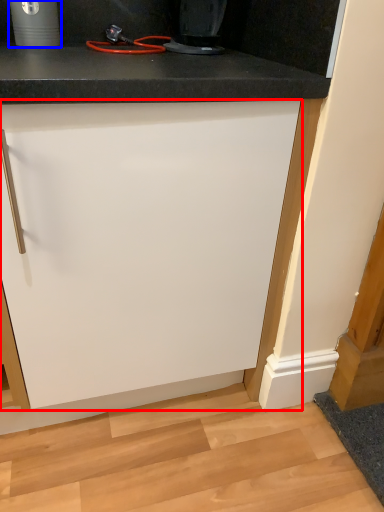
Question: Which object appears farthest to the camera in this image, cabinetry (highlighted by a red box) or appliance (highlighted by a blue box)?

Choices:
 (A) cabinetry
 (B) appliance

Answer: (B)